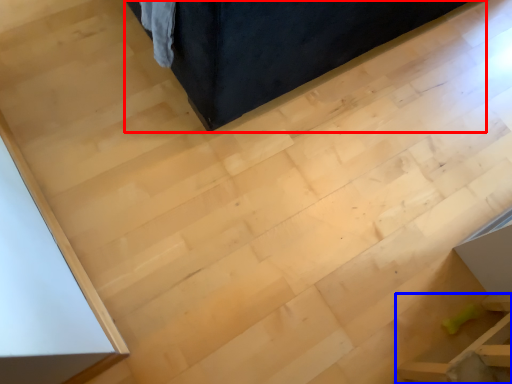
Question: Which of the following is the closest to the observer, furniture (highlighted by a red box) or furniture (highlighted by a blue box)?

Choices:
 (A) furniture
 (B) furniture

Answer: (B)